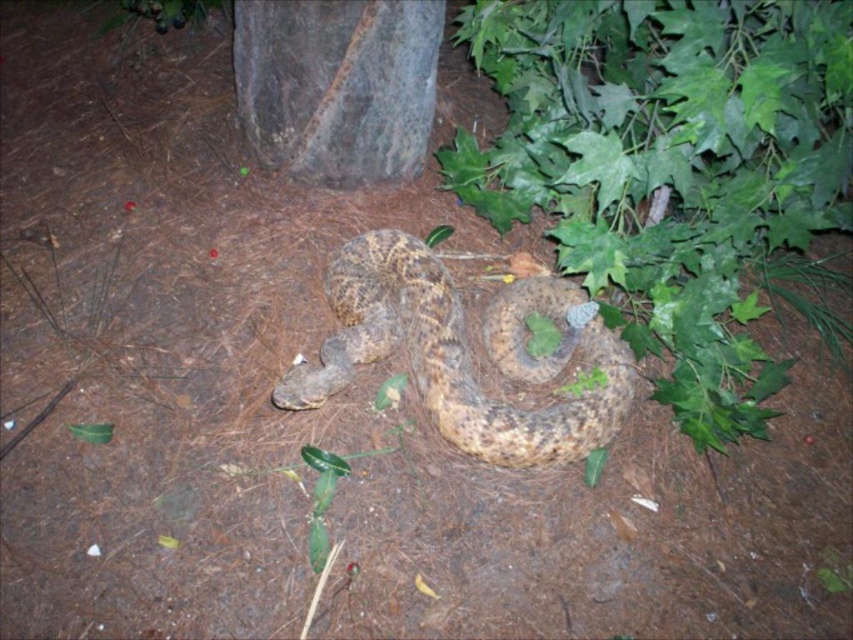
Is camouflage-patterned snake at center thinner than rusty metal tree trunk at center?

No.

The height and width of the screenshot is (640, 853). What do you see at coordinates (463, 353) in the screenshot?
I see `camouflage-patterned snake at center` at bounding box center [463, 353].

I want to click on camouflage-patterned snake at center, so click(x=463, y=353).

Is green leafy plant at center wider than rusty metal tree trunk at center?

Yes, green leafy plant at center is wider than rusty metal tree trunk at center.

Is green leafy plant at center taller than rusty metal tree trunk at center?

Correct, green leafy plant at center is much taller as rusty metal tree trunk at center.

Image resolution: width=853 pixels, height=640 pixels. What are the coordinates of `green leafy plant at center` in the screenshot? It's located at (671, 164).

The width and height of the screenshot is (853, 640). What do you see at coordinates (671, 164) in the screenshot?
I see `green leafy plant at center` at bounding box center [671, 164].

Who is more distant from viewer, (672, 387) or (608, 396)?

Point (672, 387)

Where is `green leafy plant at center`? This screenshot has width=853, height=640. green leafy plant at center is located at coordinates (671, 164).